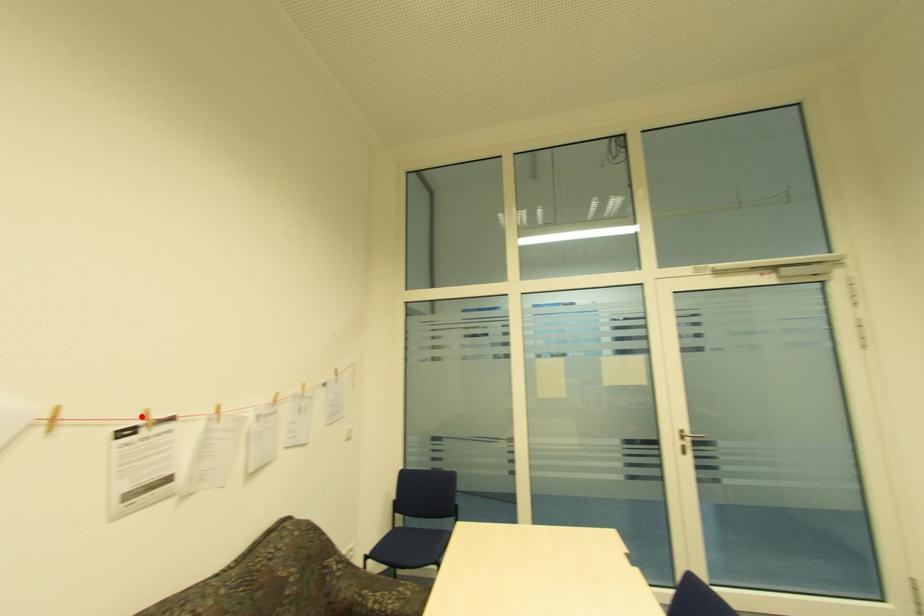
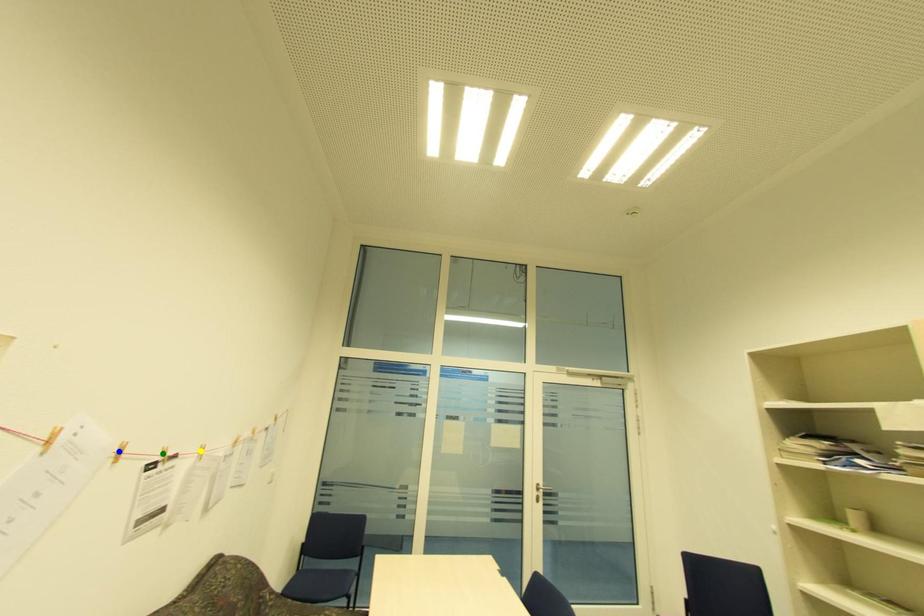
Question: I am providing you with two images of the same scene from different viewpoints. A red point is marked on the first image. You are given multiple points on the second image. Which point in image 2 represents the same 3d spot as the red point in image 1?

Choices:
 (A) yellow point
 (B) green point
 (C) blue point

Answer: (B)